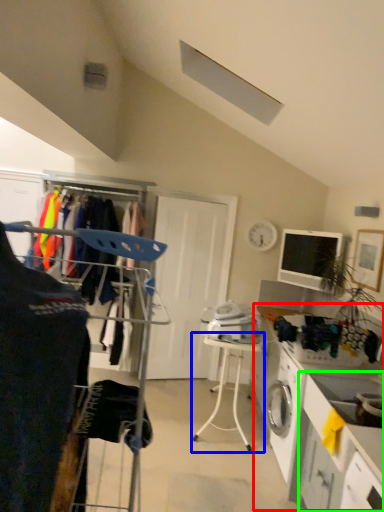
Question: Based on their relative distances, which object is nearer to counter (highlighted by a red box)? Choose from table (highlighted by a blue box) and counter (highlighted by a green box).

Choices:
 (A) table
 (B) counter

Answer: (B)